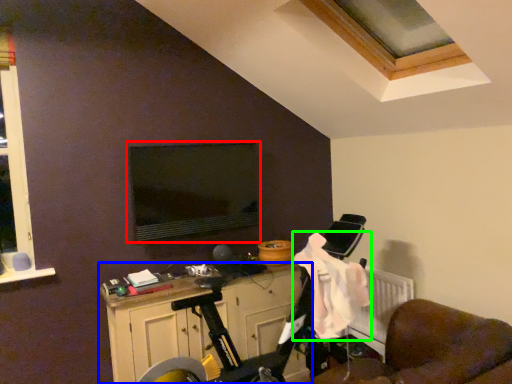
Question: Which object is the closest to the computer monitor (highlighted by a red box)? Choose among these: cabinetry (highlighted by a blue box) or laundry (highlighted by a green box).

Choices:
 (A) cabinetry
 (B) laundry

Answer: (A)